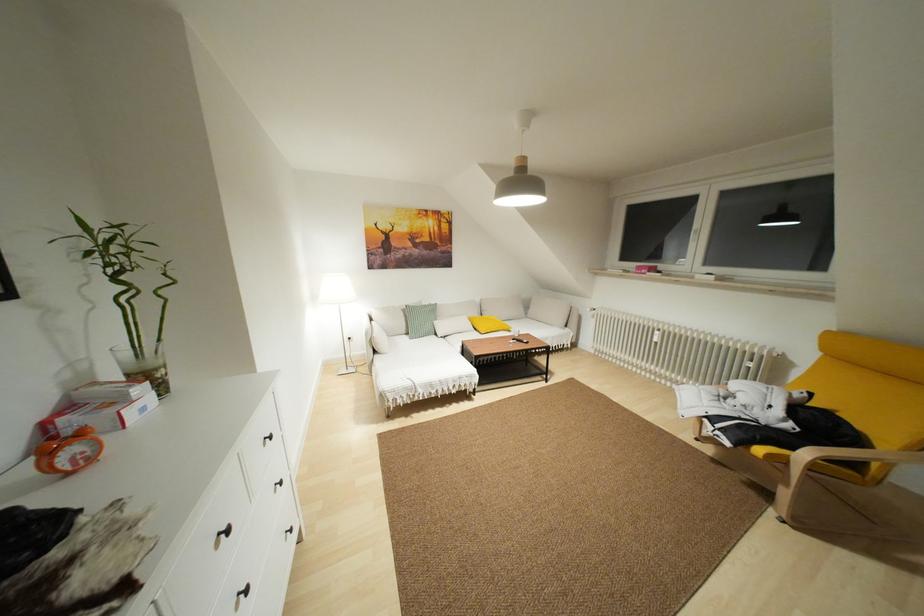
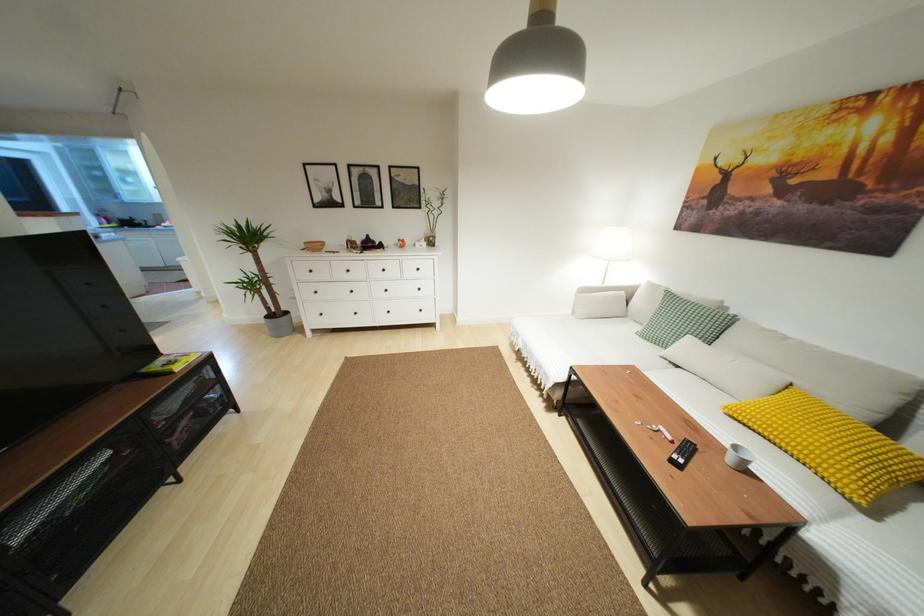
Find the pixel in the second image that matches point 150,363 in the first image.

(430, 233)